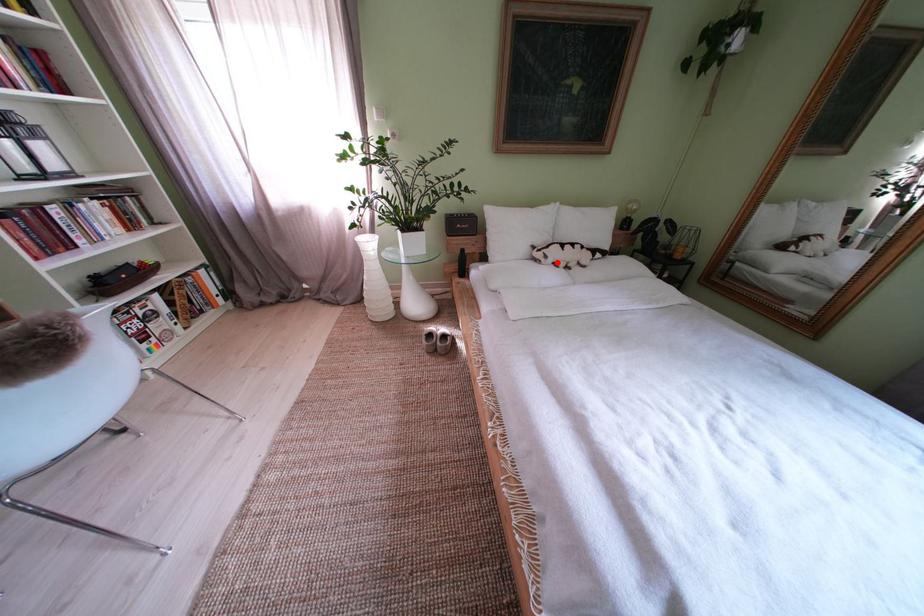
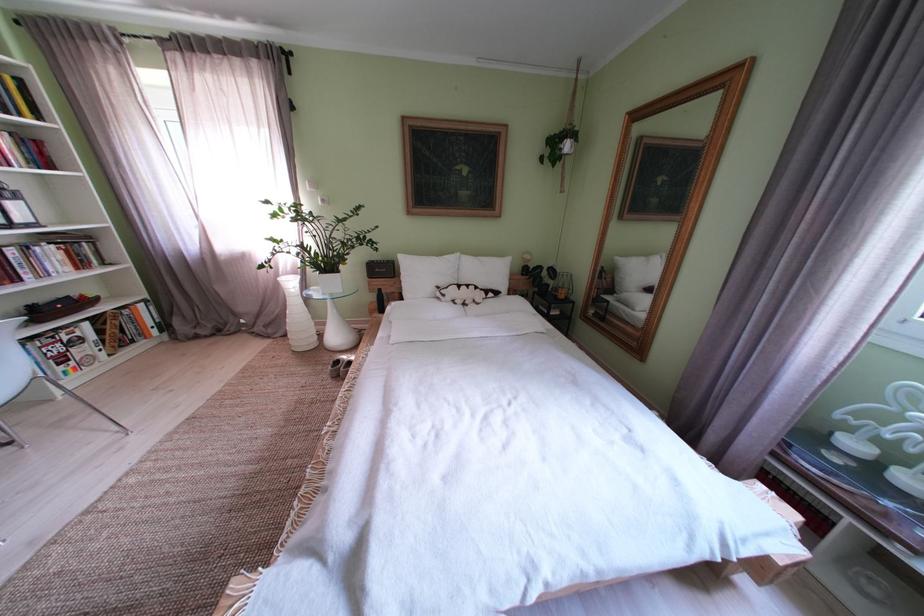
In the second image, find the point that corresponds to the highlighted location in the first image.

(455, 301)